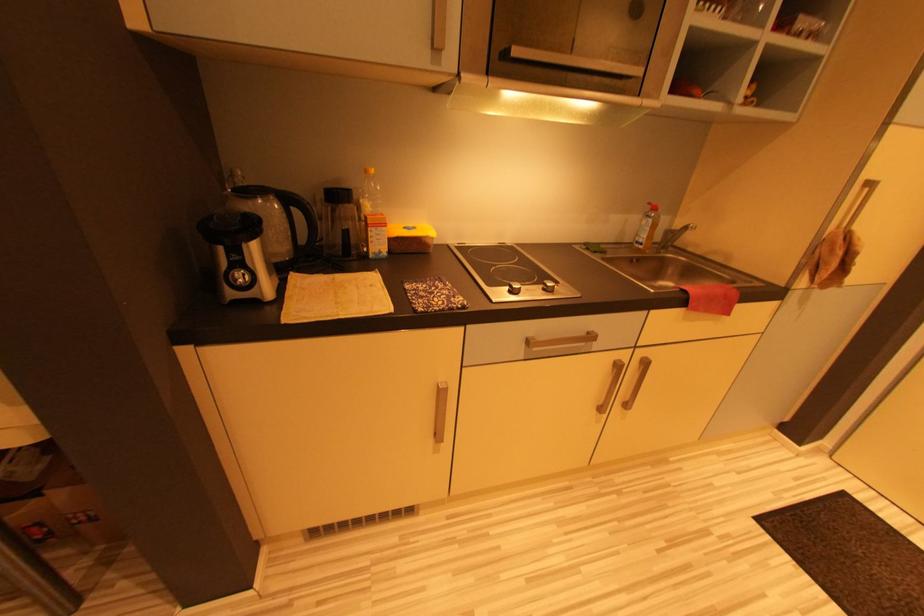
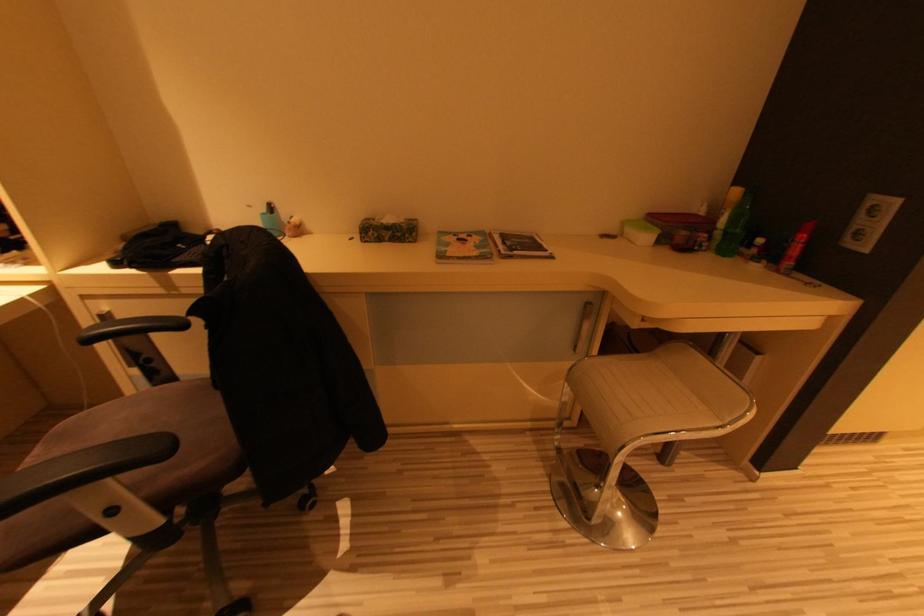
Question: In a continuous first-person perspective shot, in which direction is the camera moving?

Choices:
 (A) Left
 (B) Right
 (C) Forward
 (D) Backward

Answer: (A)